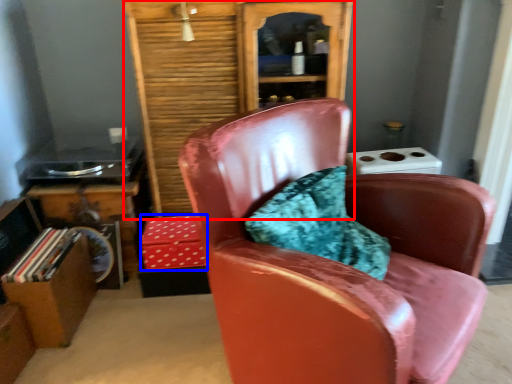
Question: Among these objects, which one is farthest to the camera, bookcase (highlighted by a red box) or box (highlighted by a blue box)?

Choices:
 (A) bookcase
 (B) box

Answer: (B)